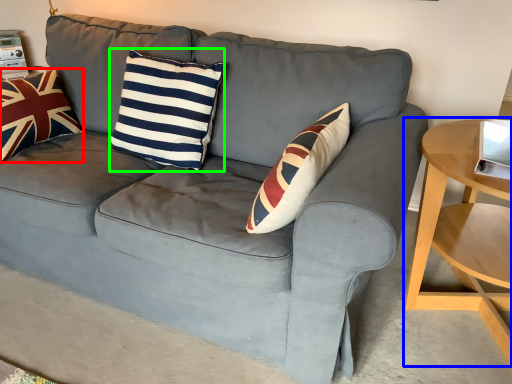
Question: Which is farther away from pillow (highlighted by a red box)? table (highlighted by a blue box) or pillow (highlighted by a green box)?

Choices:
 (A) table
 (B) pillow

Answer: (A)